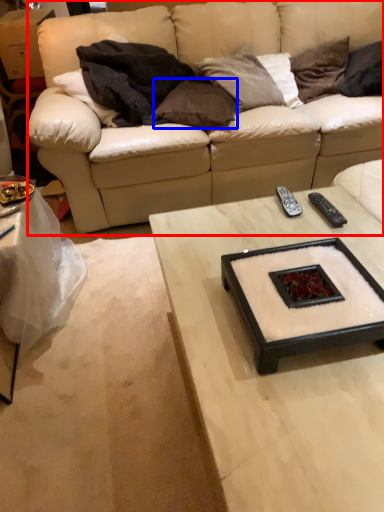
Question: Which of the following is the closest to the observer, studio couch (highlighted by a red box) or pillow (highlighted by a blue box)?

Choices:
 (A) studio couch
 (B) pillow

Answer: (A)